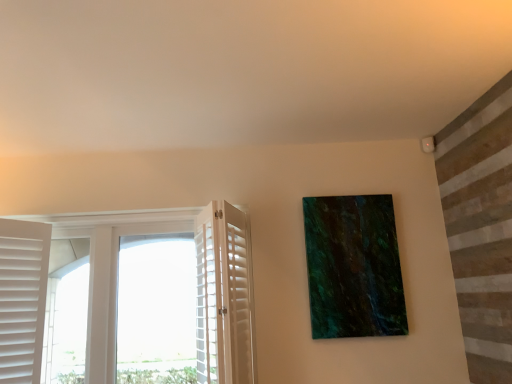
Question: Are white wooden shutters at left and green marble painting at upper right making contact?

Choices:
 (A) yes
 (B) no

Answer: (B)

Question: Is white wooden shutters at left facing away from green marble painting at upper right?

Choices:
 (A) no
 (B) yes

Answer: (A)

Question: Is white wooden shutters at left wider than green marble painting at upper right?

Choices:
 (A) no
 (B) yes

Answer: (B)

Question: Does white wooden shutters at left have a smaller size compared to green marble painting at upper right?

Choices:
 (A) no
 (B) yes

Answer: (A)

Question: Is white wooden shutters at left thinner than green marble painting at upper right?

Choices:
 (A) yes
 (B) no

Answer: (B)

Question: From the image's perspective, relative to green marble painting at upper right, is white wooden shutters at left above or below?

Choices:
 (A) below
 (B) above

Answer: (A)

Question: Considering the relative positions of white wooden shutters at left and green marble painting at upper right in the image provided, is white wooden shutters at left to the left or to the right of green marble painting at upper right?

Choices:
 (A) left
 (B) right

Answer: (A)

Question: From a real-world perspective, relative to green marble painting at upper right, is white wooden shutters at left vertically above or below?

Choices:
 (A) above
 (B) below

Answer: (B)

Question: Is white wooden shutters at left wider or thinner than green marble painting at upper right?

Choices:
 (A) thin
 (B) wide

Answer: (B)

Question: Relative to white wooden shutters at left, is green marble painting at upper right in front or behind?

Choices:
 (A) front
 (B) behind

Answer: (B)

Question: Based on their positions, is green marble painting at upper right located to the left or right of white wooden shutters at left?

Choices:
 (A) left
 (B) right

Answer: (B)

Question: Looking at their shapes, would you say green marble painting at upper right is wider or thinner than white wooden shutters at left?

Choices:
 (A) thin
 (B) wide

Answer: (A)

Question: Is green marble painting at upper right bigger or smaller than white wooden shutters at left?

Choices:
 (A) big
 (B) small

Answer: (B)

Question: Considering the positions of white wooden shutters at left and white wood screen door at left in the image, is white wooden shutters at left wider or thinner than white wood screen door at left?

Choices:
 (A) wide
 (B) thin

Answer: (A)

Question: From the image's perspective, relative to white wood screen door at left, is white wooden shutters at left above or below?

Choices:
 (A) above
 (B) below

Answer: (B)